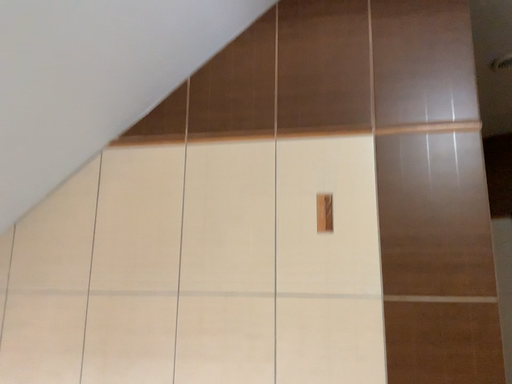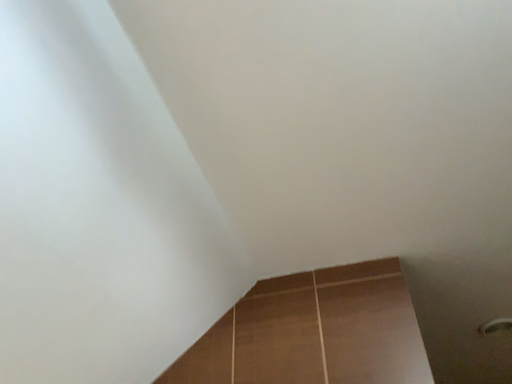
Question: How did the camera likely rotate when shooting the video?

Choices:
 (A) rotated upward
 (B) rotated downward

Answer: (A)